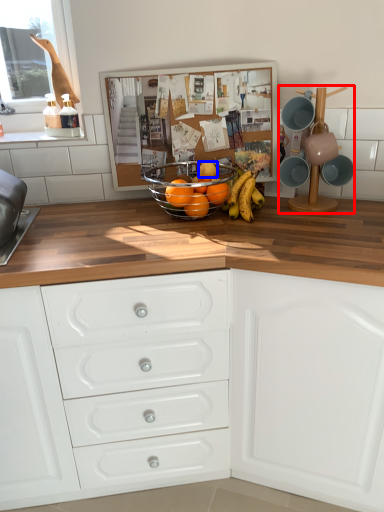
Question: Among these objects, which one is nearest to the camera, appliance (highlighted by a red box) or fruit (highlighted by a blue box)?

Choices:
 (A) appliance
 (B) fruit

Answer: (A)